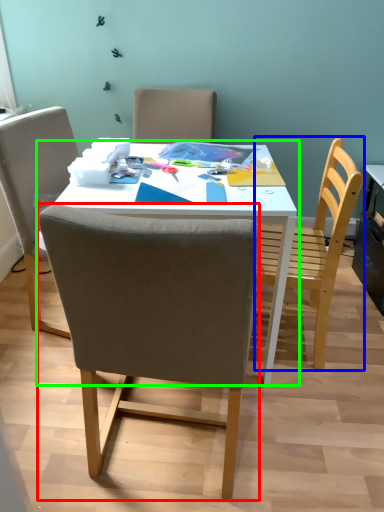
Question: Considering the real-world distances, which object is closest to chair (highlighted by a red box)? chair (highlighted by a blue box) or table (highlighted by a green box).

Choices:
 (A) chair
 (B) table

Answer: (B)